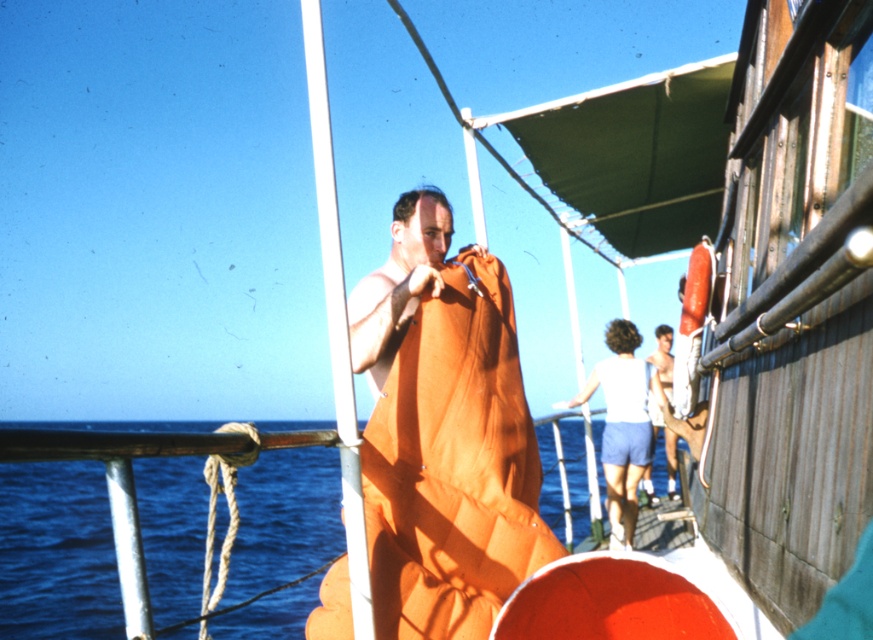
You are a sailor on the boat and need to know which area is larger between the blue water at lower left and the white fabric at center. Which one is bigger?

The blue water at lower left is bigger than the white fabric at center according to the description.

You are standing at point (308, 634) on the boat deck. The two people in the background are walking towards you. If they walk at a speed of 1.5 meters per second, how many seconds will it take for them to reach you?

The two people in the background are 3.42 meters away from point (308, 634). At a speed of 1.5 meters per second, it will take them approximately 2.28 seconds to reach you.